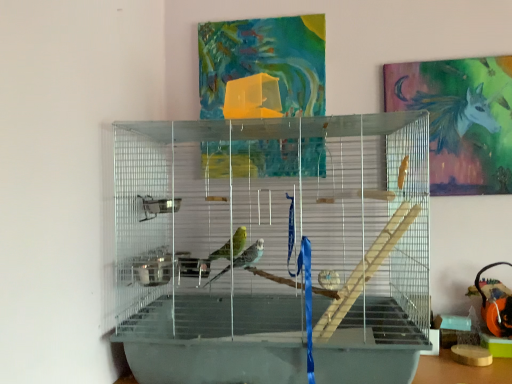
Question: From their relative heights in the image, would you say metallic unicorn at upper right is taller or shorter than clear plastic birdcage at center?

Choices:
 (A) tall
 (B) short

Answer: (B)

Question: Considering the positions of point (453, 122) and point (162, 248), is point (453, 122) closer or farther from the camera than point (162, 248)?

Choices:
 (A) closer
 (B) farther

Answer: (A)

Question: Would you say metallic unicorn at upper right is inside or outside clear plastic birdcage at center?

Choices:
 (A) outside
 (B) inside

Answer: (A)

Question: Would you say clear plastic birdcage at center is to the left or to the right of metallic unicorn at upper right in the picture?

Choices:
 (A) right
 (B) left

Answer: (B)

Question: Which is correct: clear plastic birdcage at center is inside metallic unicorn at upper right, or outside of it?

Choices:
 (A) inside
 (B) outside

Answer: (B)

Question: Looking at their shapes, would you say clear plastic birdcage at center is wider or thinner than metallic unicorn at upper right?

Choices:
 (A) wide
 (B) thin

Answer: (A)

Question: Considering the positions of point (312, 256) and point (448, 120), is point (312, 256) closer or farther from the camera than point (448, 120)?

Choices:
 (A) farther
 (B) closer

Answer: (B)